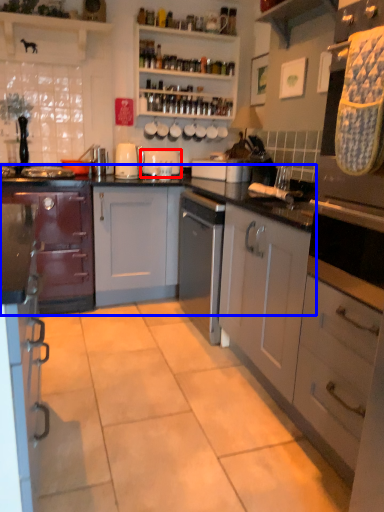
Question: Which object appears closest to the camera in this image, appliance (highlighted by a red box) or cabinetry (highlighted by a blue box)?

Choices:
 (A) appliance
 (B) cabinetry

Answer: (B)